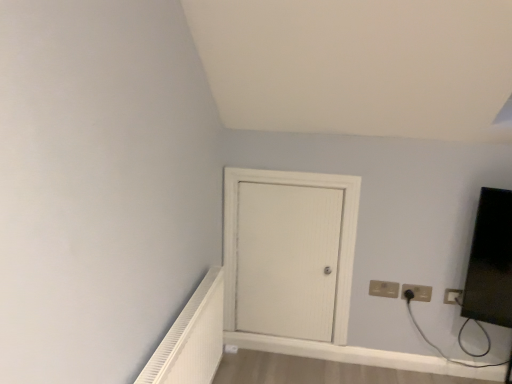
Question: In terms of width, does white plastic electric outlet at upper right, the third electric outlet when ordered from left to right, look wider or thinner when compared to white textured radiator at lower left?

Choices:
 (A) wide
 (B) thin

Answer: (B)

Question: Considering their positions, is white plastic electric outlet at upper right, the third electric outlet when ordered from left to right, located in front of or behind white textured radiator at lower left?

Choices:
 (A) front
 (B) behind

Answer: (B)

Question: Considering the real-world distances, which object is closest to the white plastic electric outlet at upper right, marked as the 1th electric outlet in a right-to-left arrangement?

Choices:
 (A) white textured radiator at lower left
 (B) white wood door at center
 (C) beige plastic electric outlet at lower right, the third electric outlet positioned from the right
 (D) matte black outlet at upper right, the 2th electric outlet positioned from the right

Answer: (D)

Question: Which of these objects is positioned closest to the white textured radiator at lower left?

Choices:
 (A) matte black outlet at upper right, which is the second electric outlet in left-to-right order
 (B) white wood door at center
 (C) white plastic electric outlet at upper right, the third electric outlet when ordered from left to right
 (D) beige plastic electric outlet at lower right, the third electric outlet positioned from the right

Answer: (B)